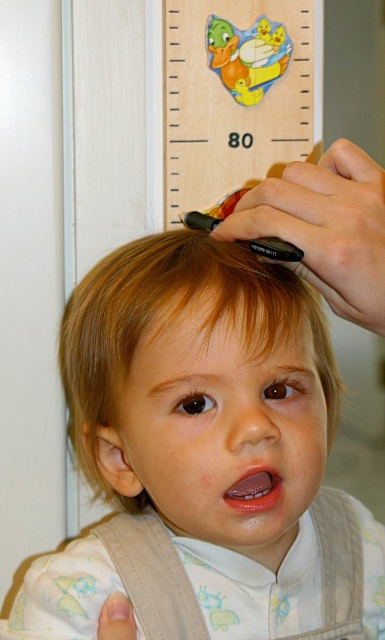
Question: Which of the following is the closest to the observer?

Choices:
 (A) light brown hair at center
 (B) wooden ruler at upper center

Answer: (A)

Question: Does light brown hair at center have a smaller size compared to wooden ruler at upper center?

Choices:
 (A) no
 (B) yes

Answer: (A)

Question: Among these objects, which one is nearest to the camera?

Choices:
 (A) light brown hair at center
 (B) wooden ruler at upper center

Answer: (A)

Question: Does light brown hair at center have a smaller size compared to wooden ruler at upper center?

Choices:
 (A) no
 (B) yes

Answer: (A)

Question: Does light brown hair at center have a lesser width compared to wooden ruler at upper center?

Choices:
 (A) yes
 (B) no

Answer: (B)

Question: Which of the following is the farthest from the observer?

Choices:
 (A) (241, 368)
 (B) (234, 108)

Answer: (B)